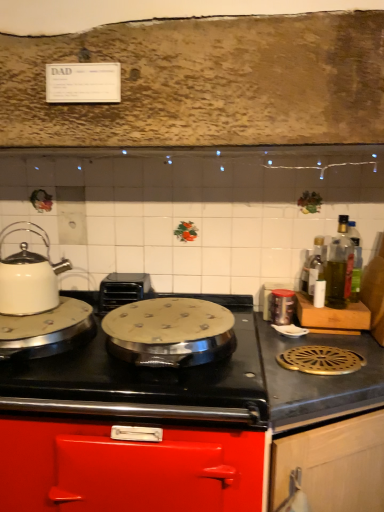
Find the location of a particular element. The width and height of the screenshot is (384, 512). space that is in front of metallic canister at right, positioned as the 2th kitchen appliance in front-to-back order is located at coordinates (291, 338).